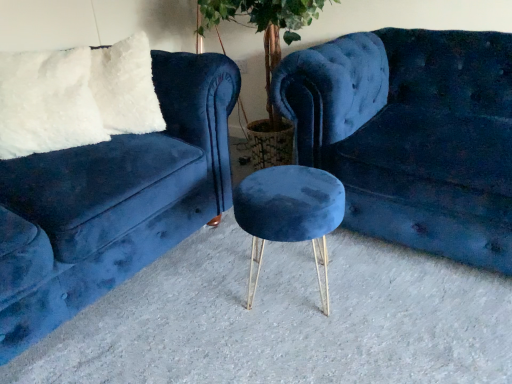
Locate an element on the screen. free point below velvet blue stool at center (from a real-world perspective) is located at coordinates (286, 279).